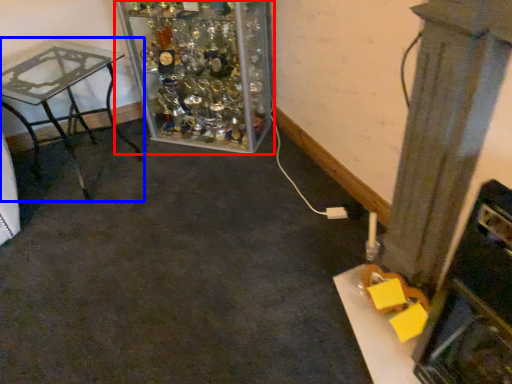
Question: Which point is further to the camera, furniture (highlighted by a red box) or table (highlighted by a blue box)?

Choices:
 (A) furniture
 (B) table

Answer: (A)